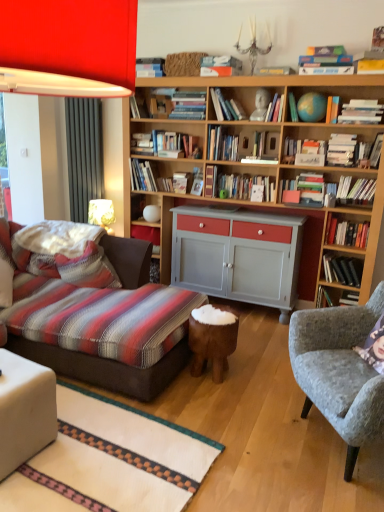
Locate an element on the screen. empty space that is ontop of white paper book at upper right, which ranks as the fifteenth book in left-to-right order (from a real-world perspective) is located at coordinates (350, 130).